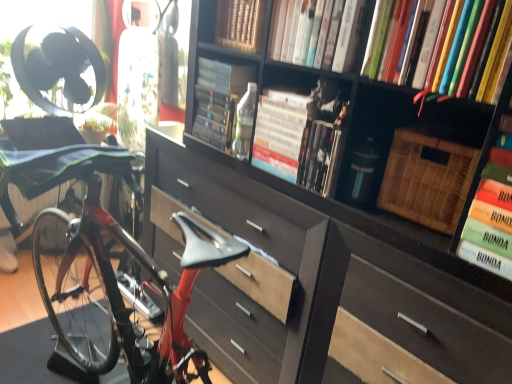
Locate an element on the screen. The height and width of the screenshot is (384, 512). hardcover books at upper right, the 6th book in the left-to-right sequence is located at coordinates (455, 46).

The width and height of the screenshot is (512, 384). What do you see at coordinates (279, 133) in the screenshot?
I see `hardcover book at upper center, which ranks as the 3th book in left-to-right order` at bounding box center [279, 133].

The image size is (512, 384). Describe the element at coordinates (318, 155) in the screenshot. I see `hardcover book at center, the third book when ordered from right to left` at that location.

Measure the distance between point (65,287) and camera.

A distance of 7.21 feet exists between point (65,287) and camera.

Locate an element on the screen. The image size is (512, 384). dark wood bookcase at center is located at coordinates (327, 253).

Identify the location of hardcover books at upper right, which is the second book from right to left. The image size is (512, 384). (455, 46).

The image size is (512, 384). In order to click on book that is the 4th object to the right of the hardcover book at upper center, which ranks as the fifth book in right-to-left order, starting at the anchor in this screenshot , I will do `click(490, 205)`.

Is green matte book at right, arranged as the seventh book when viewed from the left, positioned beyond the bounds of hardcover book at upper center, which ranks as the 3th book in left-to-right order?

Indeed, green matte book at right, arranged as the seventh book when viewed from the left, is completely outside hardcover book at upper center, which ranks as the 3th book in left-to-right order.

From the picture: Is green matte book at right, the 1th book viewed from the right, next to hardcover book at upper center, which ranks as the fifth book in right-to-left order?

No, green matte book at right, the 1th book viewed from the right, is not beside hardcover book at upper center, which ranks as the fifth book in right-to-left order.

Between green matte book at right, the 1th book viewed from the right, and hardcover book at upper center, which ranks as the fifth book in right-to-left order, which one has smaller size?

With smaller size is green matte book at right, the 1th book viewed from the right.

From the image's perspective, who appears lower, dark wood bookcase at center or hardcover book at center, which is the 1th book from left to right?

dark wood bookcase at center appears lower in the image.

Is dark wood bookcase at center not near hardcover book at center, which is the 1th book from left to right?

No, dark wood bookcase at center is in close proximity to hardcover book at center, which is the 1th book from left to right.

Considering the positions of objects dark wood bookcase at center and hardcover book at center, marked as the 7th book in a right-to-left arrangement, in the image provided, who is more to the right, dark wood bookcase at center or hardcover book at center, marked as the 7th book in a right-to-left arrangement,?

Positioned to the right is dark wood bookcase at center.

Considering the sizes of objects dark wood bookcase at center and hardcover book at center, which is the 1th book from left to right, in the image provided, who is thinner, dark wood bookcase at center or hardcover book at center, which is the 1th book from left to right,?

Thinner between the two is hardcover book at center, which is the 1th book from left to right.

From the image's perspective, between shiny red bicycle at left and woven brown basket at upper right, which one is located above?

shiny red bicycle at left.

The height and width of the screenshot is (384, 512). What are the coordinates of `basket on the right of shiny red bicycle at left` in the screenshot? It's located at (426, 179).

Is shiny red bicycle at left facing towards woven brown basket at upper right?

Yes, shiny red bicycle at left is turned towards woven brown basket at upper right.

From a real-world perspective, is shiny red bicycle at left below hardcover book at upper center, which ranks as the 3th book in left-to-right order?

Correct, in the physical world, shiny red bicycle at left is lower than hardcover book at upper center, which ranks as the 3th book in left-to-right order.

From the picture: Is shiny red bicycle at left behind hardcover book at upper center, which ranks as the 3th book in left-to-right order?

That is True.

Would you say shiny red bicycle at left is a long distance from hardcover book at upper center, which ranks as the 3th book in left-to-right order?

No, shiny red bicycle at left is not far away from hardcover book at upper center, which ranks as the 3th book in left-to-right order.

Is point (4, 159) farther from viewer compared to point (295, 169)?

Yes, point (4, 159) is farther from viewer.

From the image's perspective, is hardcover book at upper center, which ranks as the 3th book in left-to-right order, under green fabric swivel chair at left?

No.

Where is `swivel chair below the hardcover book at upper center, which ranks as the 3th book in left-to-right order (from the image's perspective)`? This screenshot has width=512, height=384. swivel chair below the hardcover book at upper center, which ranks as the 3th book in left-to-right order (from the image's perspective) is located at coordinates (42, 132).

Considering the sizes of objects hardcover book at upper center, which ranks as the 3th book in left-to-right order, and green fabric swivel chair at left in the image provided, who is taller, hardcover book at upper center, which ranks as the 3th book in left-to-right order, or green fabric swivel chair at left?

hardcover book at upper center, which ranks as the 3th book in left-to-right order.

I want to click on the 3rd book directly above the hardcover book at center, marked as the 7th book in a right-to-left arrangement (from a real-world perspective), so click(x=316, y=33).

Which object is thinner, hardcover book at upper center, the fourth book when ordered from right to left, or hardcover book at center, which is the 1th book from left to right?

With smaller width is hardcover book at upper center, the fourth book when ordered from right to left.

Is point (337, 21) positioned in front of point (218, 138)?

Yes, it is.

Is hardcover book at upper center, the fourth book when ordered from right to left, completely or partially outside of hardcover book at center, which is the 1th book from left to right?

Yes, hardcover book at upper center, the fourth book when ordered from right to left, is located beyond the bounds of hardcover book at center, which is the 1th book from left to right.

Based on the photo, is green matte book at right, arranged as the seventh book when viewed from the left, smaller than hardcover book at center, the third book when ordered from right to left?

Actually, green matte book at right, arranged as the seventh book when viewed from the left, might be larger than hardcover book at center, the third book when ordered from right to left.

What's the angular difference between green matte book at right, the 1th book viewed from the right, and hardcover book at center, arranged as the 5th book when viewed from the left,'s facing directions?

The angle between the facing direction of green matte book at right, the 1th book viewed from the right, and the facing direction of hardcover book at center, arranged as the 5th book when viewed from the left, is 0.358 degrees.

Considering the relative sizes of green matte book at right, arranged as the seventh book when viewed from the left, and hardcover book at center, the third book when ordered from right to left, in the image provided, is green matte book at right, arranged as the seventh book when viewed from the left, taller than hardcover book at center, the third book when ordered from right to left,?

Yes.

From the image's perspective, starting from the green matte book at right, arranged as the seventh book when viewed from the left, which book is the 2nd one above? Please provide its 2D coordinates.

[(279, 133)]

Identify the location of book that is the 3rd one when counting leftward from the dark wood bookcase at center. (219, 100).

From the image, which object appears to be farther from dark wood bookcase at center, hardcover book at upper center, the fourth book when ordered from right to left, or hardcover book at center, marked as the 7th book in a right-to-left arrangement?

Based on the image, hardcover book at upper center, the fourth book when ordered from right to left, appears to be further to dark wood bookcase at center.

Estimate the real-world distances between objects in this image. Which object is further from hardcover book at upper center, which ranks as the fifth book in right-to-left order, green fabric swivel chair at left or hardcover book at center, which is the 1th book from left to right?

Based on the image, green fabric swivel chair at left appears to be further to hardcover book at upper center, which ranks as the fifth book in right-to-left order.

From the image, which object appears to be farther from wooden book at upper center, the 6th book when ordered from right to left, green fabric swivel chair at left or hardcover book at upper center, the fourth book when ordered from right to left?

Among the two, green fabric swivel chair at left is located further to wooden book at upper center, the 6th book when ordered from right to left.

From the image, which object appears to be nearer to hardcover book at upper center, which ranks as the 3th book in left-to-right order, hardcover book at upper center, the fourth book when ordered from right to left, or woven brown basket at upper right?

hardcover book at upper center, the fourth book when ordered from right to left, is positioned closer to the anchor hardcover book at upper center, which ranks as the 3th book in left-to-right order.

Looking at this image, which object lies nearer to the anchor point woven brown basket at upper right, hardcover book at upper center, the fourth book when ordered from right to left, or shiny red bicycle at left?

hardcover book at upper center, the fourth book when ordered from right to left.

Looking at the image, which one is located closer to hardcover book at center, marked as the 7th book in a right-to-left arrangement, shiny red bicycle at left or hardcover book at upper center, the fourth book when ordered from right to left?

hardcover book at upper center, the fourth book when ordered from right to left, is closer to hardcover book at center, marked as the 7th book in a right-to-left arrangement.

Based on their spatial positions, is wooden book at upper center, the 6th book when ordered from right to left, or hardcover book at upper center, which ranks as the 3th book in left-to-right order, further from woven brown basket at upper right?

wooden book at upper center, the 6th book when ordered from right to left, is further to woven brown basket at upper right.

Estimate the real-world distances between objects in this image. Which object is further from hardcover book at upper center, which ranks as the fifth book in right-to-left order, wooden book at upper center, the 2th book in the left-to-right sequence, or hardcover books at upper right, which is the second book from right to left?

Based on the image, hardcover books at upper right, which is the second book from right to left, appears to be further to hardcover book at upper center, which ranks as the fifth book in right-to-left order.

Locate an element on the screen. basket between hardcover book at center, marked as the 7th book in a right-to-left arrangement, and green matte book at right, arranged as the seventh book when viewed from the left, from left to right is located at coordinates (426, 179).

At what (x,y) coordinates should I click in order to perform the action: click on basket positioned between hardcover books at upper right, the 6th book in the left-to-right sequence, and hardcover book at upper center, which ranks as the fifth book in right-to-left order, from near to far. Please return your answer as a coordinate pair (x, y). The image size is (512, 384). Looking at the image, I should click on (426, 179).

Locate an element on the screen. This screenshot has height=384, width=512. basket between hardcover book at upper center, arranged as the 4th book when viewed from the left, and green matte book at right, the 1th book viewed from the right, from top to bottom is located at coordinates (426, 179).

Find the location of a particular element. basket between hardcover book at upper center, which ranks as the 3th book in left-to-right order, and green matte book at right, the 1th book viewed from the right, in the horizontal direction is located at coordinates (426, 179).